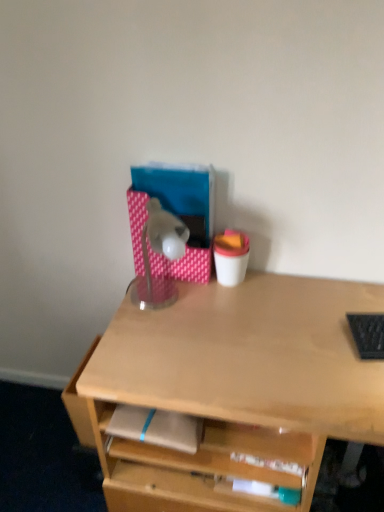
Question: Does point (155, 229) appear closer or farther from the camera than point (195, 429)?

Choices:
 (A) closer
 (B) farther

Answer: (B)

Question: In the image, is translucent plastic lamp at center positioned in front of or behind light brown matte notepad at center?

Choices:
 (A) behind
 (B) front

Answer: (A)

Question: Considering the real-world distances, which object is closest to the light brown matte notepad at center?

Choices:
 (A) translucent plastic lamp at center
 (B) black textured laptop keyboard at right

Answer: (A)

Question: Estimate the real-world distances between objects in this image. Which object is closer to the light brown matte notepad at center?

Choices:
 (A) black textured laptop keyboard at right
 (B) translucent plastic lamp at center

Answer: (B)